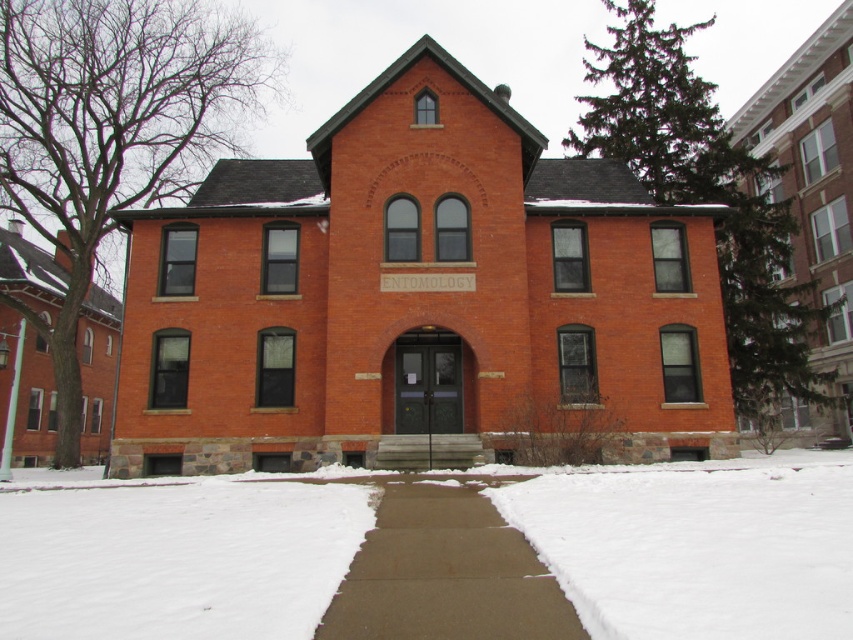
You are standing at the entrance of the two story brick building labeled ENTOMOLOGY. You want to walk to the white powdery snow at center. Which direction should you head?

You should head towards the center of the image where the white powdery snow is located at point (698, 547).

You are standing in front of the two story brick building labeled ENTOMOLOGY. You see white powdery snow at center and concrete at center. Which one is wider?

The white powdery snow at center might be wider than concrete at center.

You are standing at the entrance of the building labeled ENTOMOLOGY. There is a point marked at coordinates (698, 547). What is located at this point?

The point at coordinates (698, 547) marks white powdery snow at center.